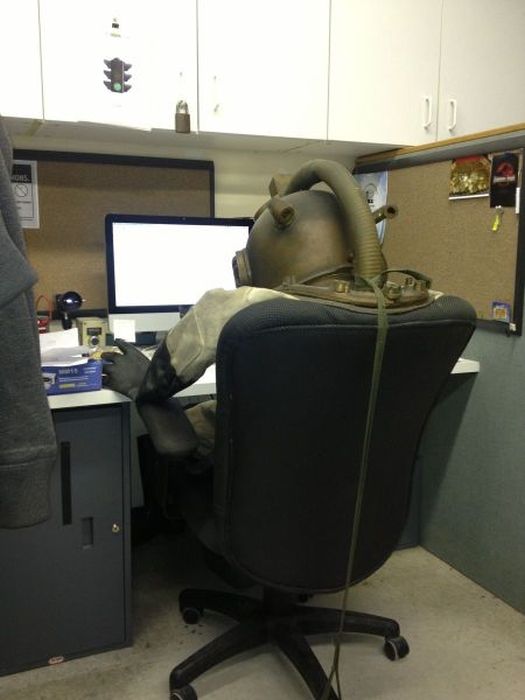
You are a GUI agent. You are given a task and a screenshot of the screen. Output one action in this format:
    pyautogui.click(x=<x>, y=<y>)
    Task: Click on the chair
    The width and height of the screenshot is (525, 700).
    Given the screenshot: What is the action you would take?
    pyautogui.click(x=345, y=440)